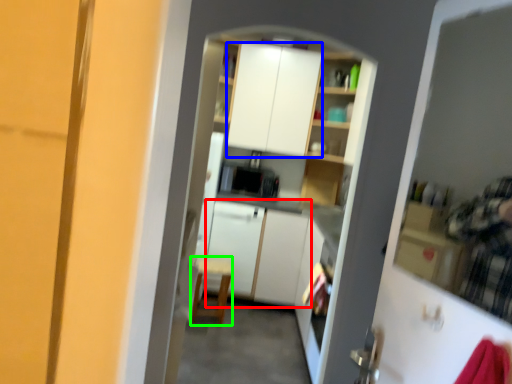
Question: Estimate the real-world distances between objects in this image. Which object is farther from cabinetry (highlighted by a red box), cabinetry (highlighted by a blue box) or chair (highlighted by a green box)?

Choices:
 (A) cabinetry
 (B) chair

Answer: (A)